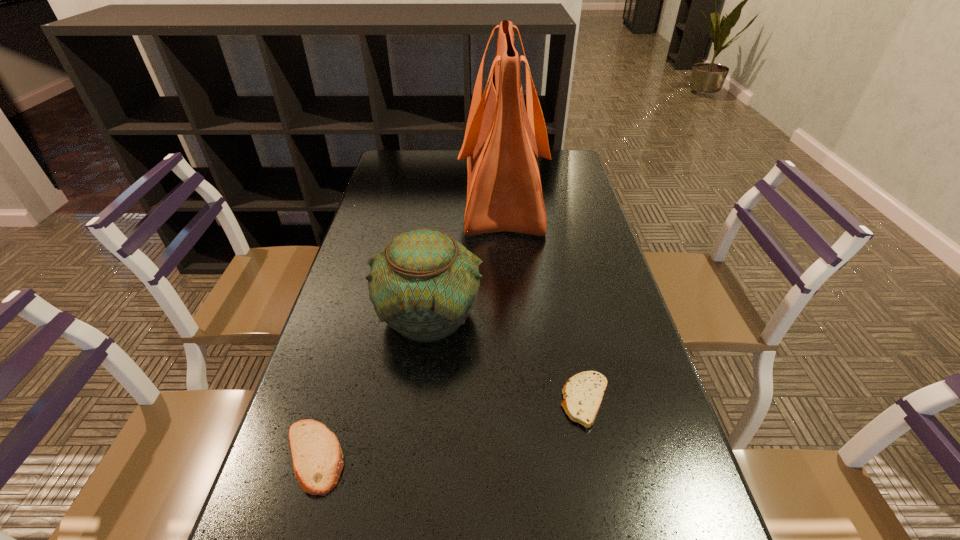
I want to click on empty location between the tallest object and the shorter pita bread, so click(543, 298).

The image size is (960, 540). I want to click on free space between the left pita bread and the shorter pita bread, so click(449, 429).

Identify the location of object that is the nearest to the pottery. Image resolution: width=960 pixels, height=540 pixels. 317,458.

In order to click on object that is the closest to the shorter pita bread in this screenshot , I will do `click(424, 284)`.

At what (x,y) coordinates should I click in order to perform the action: click on free space that satisfies the following two spatial constraints: 1. on the front pocket of the tallest object; 2. on the right side of the shorter pita bread. Please return your answer as a coordinate pair (x, y). The width and height of the screenshot is (960, 540). Looking at the image, I should click on (517, 401).

Image resolution: width=960 pixels, height=540 pixels. I want to click on vacant position in the image that satisfies the following two spatial constraints: 1. on the back side of the right pita bread; 2. on the front pocket of the shopping bag, so click(x=542, y=195).

You are a GUI agent. You are given a task and a screenshot of the screen. Output one action in this format:
    pyautogui.click(x=<x>, y=<y>)
    Task: Click on the vacant space that satisfies the following two spatial constraints: 1. on the front pocket of the shopping bag; 2. on the front side of the third nearest object
    
    Given the screenshot: What is the action you would take?
    pyautogui.click(x=511, y=315)

This screenshot has height=540, width=960. Identify the location of free space that satisfies the following two spatial constraints: 1. on the front side of the shorter pita bread; 2. on the right side of the pottery. (420, 401).